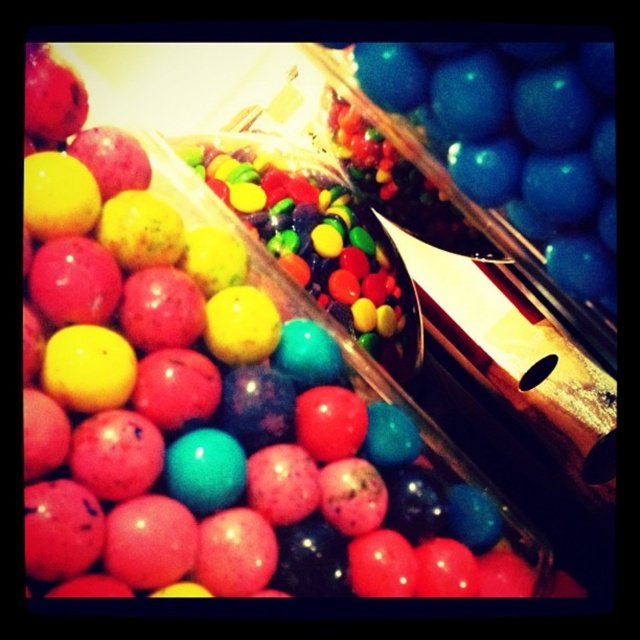
You are standing in front of a candy display case and want to reach a specific point to grab a candy. The point is located at coordinates point (600, 138). Given that your hand can comfortably reach up to 12 inches, will you be able to comfortably reach that point?

The distance of point (600, 138) from viewer is 12.82 inches, which is slightly beyond your hand reach of 12 inches. Therefore, you might need to stretch or adjust your position to reach it.

You are a customer at the candy store and want to grab a blue glossy gumballs at upper right and shiny multicolored candies at center. If you reach down first, which candy will you pick first?

The blue glossy gumballs at upper right is located above the shiny multicolored candies at center, so you will reach the blue glossy gumballs at upper right first if you start by reaching downward.